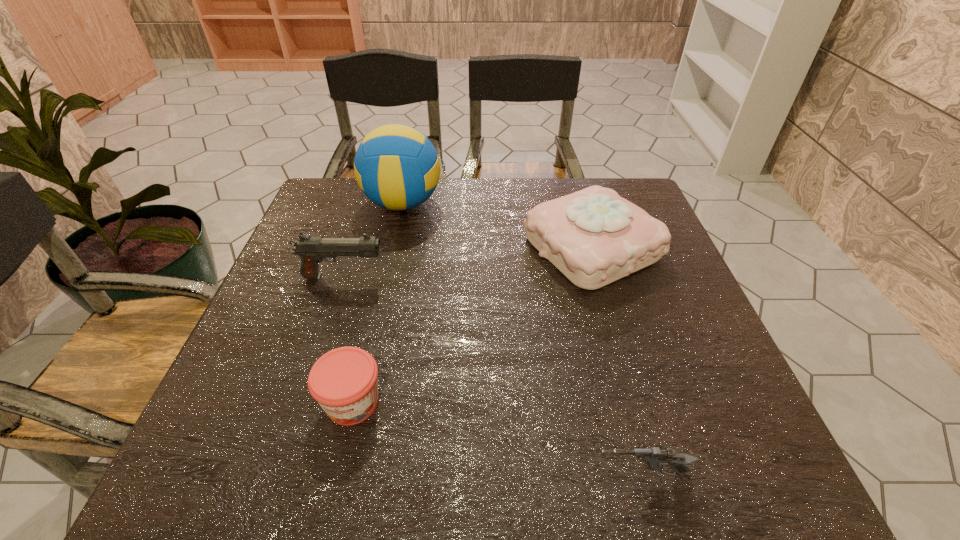
This screenshot has width=960, height=540. I want to click on object that ranks as the second closest to the taller gun, so click(343, 381).

The height and width of the screenshot is (540, 960). I want to click on object that can be found as the closest to the tallest object, so click(312, 250).